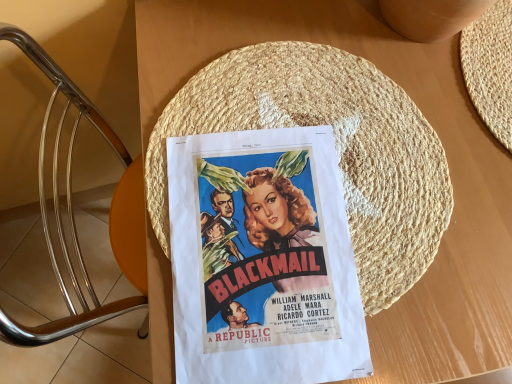
Where is `vacant space underneath natural straw hat at center (from a real-world perspective)`? vacant space underneath natural straw hat at center (from a real-world perspective) is located at coordinates (334, 187).